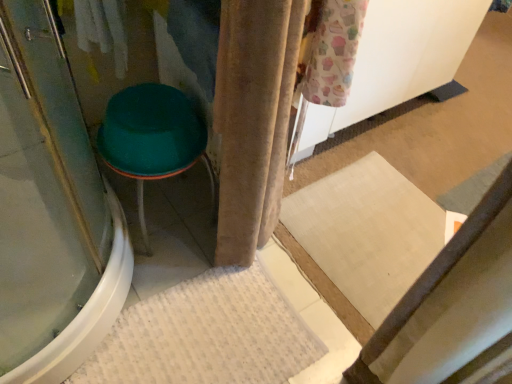
Where is `vacant area on the back side of white textured bath mat at lower center`? vacant area on the back side of white textured bath mat at lower center is located at coordinates (183, 235).